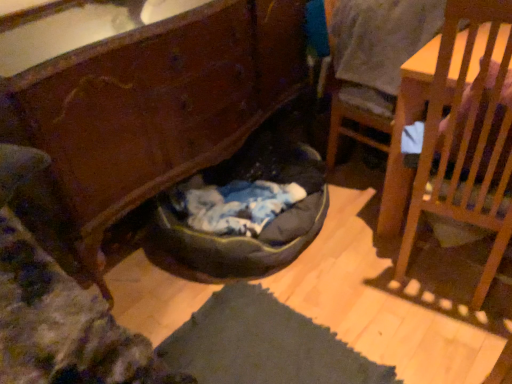
Identify the location of unoccupied area in front of dark gray fabric bean bag at lower center. The width and height of the screenshot is (512, 384). (342, 306).